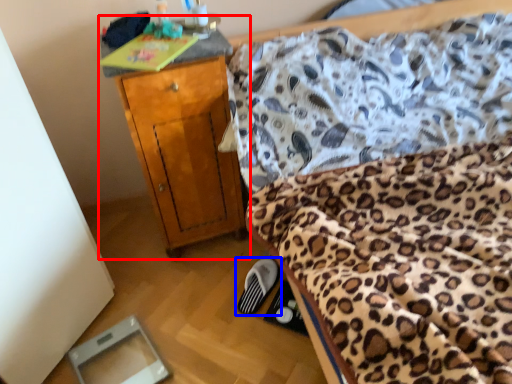
Question: Which object is closer to the camera taking this photo, nightstand (highlighted by a red box) or footwear (highlighted by a blue box)?

Choices:
 (A) nightstand
 (B) footwear

Answer: (A)